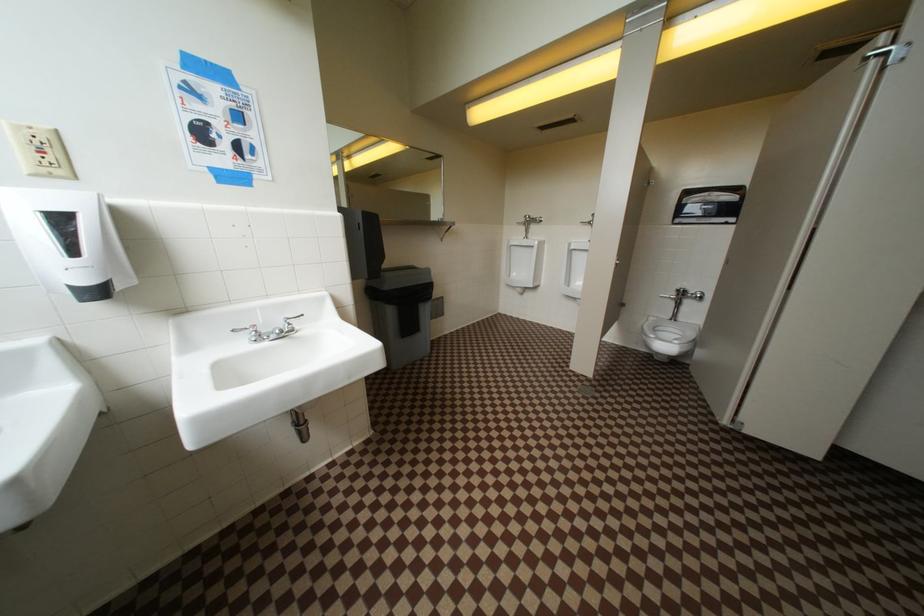
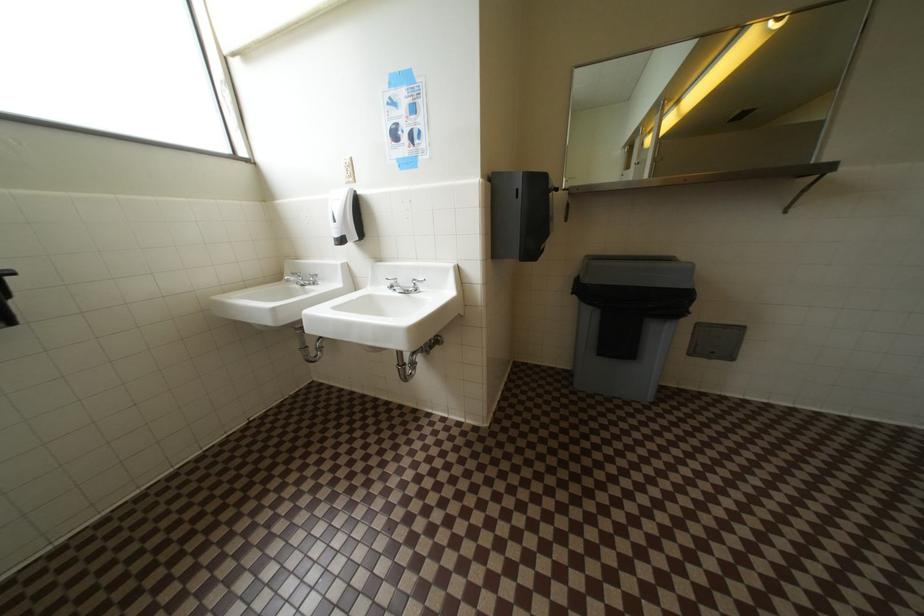
Question: How did the camera likely rotate?

Choices:
 (A) Left
 (B) Right
 (C) Up
 (D) Down

Answer: (A)